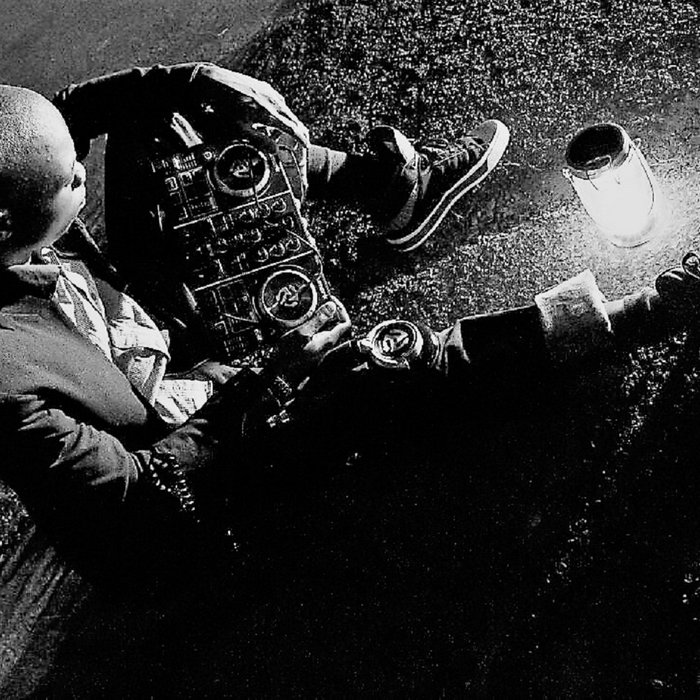
Where is `lamp`? The height and width of the screenshot is (700, 700). lamp is located at coordinates (619, 204).